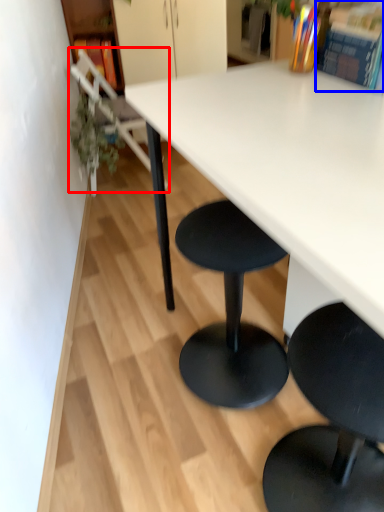
Question: Which of the following is the farthest to the observer, chair (highlighted by a red box) or book (highlighted by a blue box)?

Choices:
 (A) chair
 (B) book

Answer: (A)